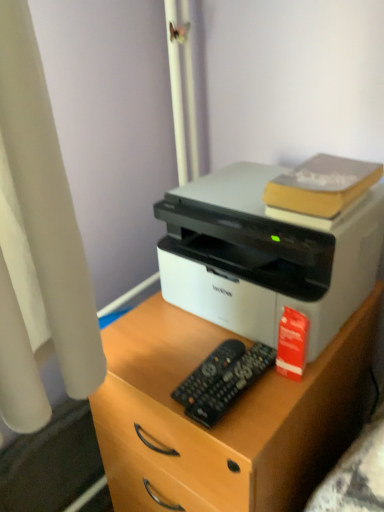
Measure the distance between point [282,353] and camera.

A distance of 29.88 inches exists between point [282,353] and camera.

Identify the location of red matte book at right, the 1th book ordered from the bottom. (292, 344).

Image resolution: width=384 pixels, height=512 pixels. What are the coordinates of `white matte printer at center` in the screenshot? It's located at (265, 256).

From the image's perspective, is white matte printer at center below red matte book at right, marked as the second book in a top-to-bottom arrangement?

No.

From a real-world perspective, who is located higher, white matte printer at center or red matte book at right, marked as the second book in a top-to-bottom arrangement?

From a 3D spatial view, white matte printer at center is above.

Considering the relative sizes of white matte printer at center and red matte book at right, marked as the second book in a top-to-bottom arrangement, in the image provided, is white matte printer at center bigger than red matte book at right, marked as the second book in a top-to-bottom arrangement,?

Yes, white matte printer at center is bigger than red matte book at right, marked as the second book in a top-to-bottom arrangement.

Which of these two, white matte printer at center or red matte book at right, the 1th book ordered from the bottom, stands shorter?

red matte book at right, the 1th book ordered from the bottom, is shorter.

Considering the positions of points (202, 372) and (314, 214), is point (202, 372) farther from camera compared to point (314, 214)?

Yes.

Can you confirm if black plastic remote at center, which is the second control from front to back, is smaller than yellow matte book at upper right, arranged as the 1th book when viewed from the top?

Yes.

From a real-world perspective, relative to yellow matte book at upper right, the 2th book ordered from the bottom, is black plastic remote at center, which is the second control from front to back, vertically above or below?

In terms of real-world spatial position, black plastic remote at center, which is the second control from front to back, is below yellow matte book at upper right, the 2th book ordered from the bottom.

Is black plastic remote at center, which is the second control from front to back, aimed at yellow matte book at upper right, arranged as the 1th book when viewed from the top?

No.

Which of these two, white matte printer at center or black plastic remote at center, the 1th control positioned from the front, stands shorter?

black plastic remote at center, the 1th control positioned from the front, is shorter.

Which object is positioned more to the left, white matte printer at center or black plastic remote at center, marked as the second control in a back-to-front arrangement?

black plastic remote at center, marked as the second control in a back-to-front arrangement, is more to the left.

Locate an element on the screen. The height and width of the screenshot is (512, 384). control that is the 1st one when counting leftward from the white matte printer at center is located at coordinates (231, 385).

Would you consider white matte printer at center to be distant from black plastic remote at center, the 1th control positioned from the front?

They are positioned close to each other.

Which control is the 2nd one when counting from the back of the white matte printer at center? Please provide its 2D coordinates.

[(208, 372)]

From a real-world perspective, is white matte printer at center physically above black plastic remote at center, which is the 1th control in back-to-front order?

Correct, in the physical world, white matte printer at center is higher than black plastic remote at center, which is the 1th control in back-to-front order.

From the image's perspective, relative to black plastic remote at center, which is the 1th control in back-to-front order, is white matte printer at center above or below?

Clearly, from the image's perspective, white matte printer at center is above black plastic remote at center, which is the 1th control in back-to-front order.

Is white matte printer at center wider than black plastic remote at center, which is the 1th control in back-to-front order?

Indeed, white matte printer at center has a greater width compared to black plastic remote at center, which is the 1th control in back-to-front order.

Are red matte book at right, the 1th book ordered from the bottom, and black plastic remote at center, which is the second control from front to back, located far from each other?

No, red matte book at right, the 1th book ordered from the bottom, is not far from black plastic remote at center, which is the second control from front to back.

Identify the location of the 1st book above when counting from the black plastic remote at center, which is the second control from front to back (from the image's perspective). (292, 344).

How far apart are red matte book at right, the 1th book ordered from the bottom, and black plastic remote at center, which is the 1th control in back-to-front order?

red matte book at right, the 1th book ordered from the bottom, is 12.03 centimeters away from black plastic remote at center, which is the 1th control in back-to-front order.

Considering the sizes of objects red matte book at right, marked as the second book in a top-to-bottom arrangement, and black plastic remote at center, which is the 1th control in back-to-front order, in the image provided, who is smaller, red matte book at right, marked as the second book in a top-to-bottom arrangement, or black plastic remote at center, which is the 1th control in back-to-front order,?

black plastic remote at center, which is the 1th control in back-to-front order.

Between red matte book at right, marked as the second book in a top-to-bottom arrangement, and yellow matte book at upper right, the 2th book ordered from the bottom, which one has smaller size?

With smaller size is red matte book at right, marked as the second book in a top-to-bottom arrangement.

In the image, is red matte book at right, the 1th book ordered from the bottom, positioned in front of or behind yellow matte book at upper right, the 2th book ordered from the bottom?

Visually, red matte book at right, the 1th book ordered from the bottom, is located behind yellow matte book at upper right, the 2th book ordered from the bottom.

Is red matte book at right, the 1th book ordered from the bottom, positioned with its back to yellow matte book at upper right, the 2th book ordered from the bottom?

No, yellow matte book at upper right, the 2th book ordered from the bottom, is not at the back of red matte book at right, the 1th book ordered from the bottom.

From a real-world perspective, is red matte book at right, marked as the second book in a top-to-bottom arrangement, beneath yellow matte book at upper right, the 2th book ordered from the bottom?

Indeed, from a real-world perspective, red matte book at right, marked as the second book in a top-to-bottom arrangement, is positioned beneath yellow matte book at upper right, the 2th book ordered from the bottom.

Who is shorter, white matte printer at center or black plastic remote at center, which is the 1th control in back-to-front order?

Standing shorter between the two is black plastic remote at center, which is the 1th control in back-to-front order.

From a real-world perspective, between white matte printer at center and black plastic remote at center, which is the second control from front to back, who is vertically higher?

In real-world perspective, black plastic remote at center, which is the second control from front to back, is above.

Do you think white matte printer at center is within black plastic remote at center, which is the 1th control in back-to-front order, or outside of it?

white matte printer at center is spatially situated outside black plastic remote at center, which is the 1th control in back-to-front order.

Who is smaller, white matte printer at center or black plastic remote at center, which is the second control from front to back?

Smaller between the two is black plastic remote at center, which is the second control from front to back.

Identify the location of printer that is above the red matte book at right, marked as the second book in a top-to-bottom arrangement (from a real-world perspective). (265, 256).

From the image's perspective, count 2nd books upward from the black plastic remote at center, which is the 1th control in back-to-front order, and point to it. Please provide its 2D coordinates.

[(321, 187)]

Based on their spatial positions, is red matte book at right, the 1th book ordered from the bottom, or white matte printer at center closer to black plastic remote at center, the 1th control positioned from the front?

red matte book at right, the 1th book ordered from the bottom, is closer to black plastic remote at center, the 1th control positioned from the front.

Looking at the image, which one is located closer to red matte book at right, the 1th book ordered from the bottom, yellow matte book at upper right, arranged as the 1th book when viewed from the top, or black plastic remote at center, which is the second control from front to back?

black plastic remote at center, which is the second control from front to back, is positioned closer to the anchor red matte book at right, the 1th book ordered from the bottom.

Looking at this image, looking at the image, which one is located closer to white matte printer at center, black plastic remote at center, which is the 1th control in back-to-front order, or red matte book at right, marked as the second book in a top-to-bottom arrangement?

Based on the image, black plastic remote at center, which is the 1th control in back-to-front order, appears to be nearer to white matte printer at center.

Estimate the real-world distances between objects in this image. Which object is closer to black plastic remote at center, the 1th control positioned from the front, white matte printer at center or black plastic remote at center, which is the second control from front to back?

black plastic remote at center, which is the second control from front to back, is positioned closer to the anchor black plastic remote at center, the 1th control positioned from the front.

Looking at the image, which one is located further to black plastic remote at center, the 1th control positioned from the front, yellow matte book at upper right, the 2th book ordered from the bottom, or black plastic remote at center, which is the second control from front to back?

Among the two, yellow matte book at upper right, the 2th book ordered from the bottom, is located further to black plastic remote at center, the 1th control positioned from the front.

Consider the image. When comparing their distances from white matte printer at center, does white matte printer at center or black plastic remote at center, marked as the second control in a back-to-front arrangement, seem closer?

white matte printer at center is positioned closer to the anchor white matte printer at center.

Looking at the image, which one is located further to white matte printer at center, black plastic remote at center, the 1th control positioned from the front, or white matte printer at center?

Based on the image, black plastic remote at center, the 1th control positioned from the front, appears to be further to white matte printer at center.

When comparing their distances from black plastic remote at center, the 1th control positioned from the front, does yellow matte book at upper right, the 2th book ordered from the bottom, or white matte printer at center seem closer?

Among the two, white matte printer at center is located nearer to black plastic remote at center, the 1th control positioned from the front.

Locate an element on the screen. This screenshot has width=384, height=512. book between yellow matte book at upper right, the 2th book ordered from the bottom, and black plastic remote at center, which is the 1th control in back-to-front order, in the vertical direction is located at coordinates (292, 344).

Find the location of a particular element. This screenshot has width=384, height=512. control between white matte printer at center and black plastic remote at center, the 1th control positioned from the front, in the vertical direction is located at coordinates (208, 372).

At what (x,y) coordinates should I click in order to perform the action: click on control that lies between black plastic remote at center, which is the 1th control in back-to-front order, and white matte printer at center from top to bottom. Please return your answer as a coordinate pair (x, y). Looking at the image, I should click on (231, 385).

Locate an element on the screen. The image size is (384, 512). control located between black plastic remote at center, which is the second control from front to back, and red matte book at right, marked as the second book in a top-to-bottom arrangement, in the left-right direction is located at coordinates (231, 385).